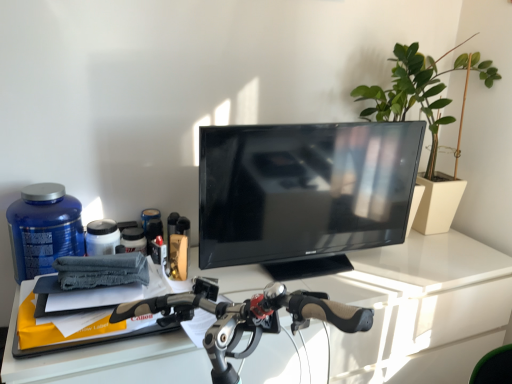
This screenshot has height=384, width=512. Identify the location of free space above white glossy desk at center (from a real-world perspective). (338, 264).